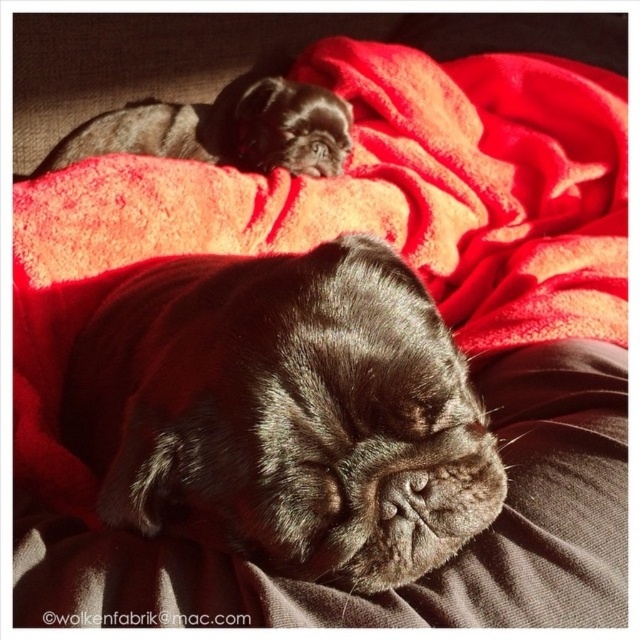
You are a photographer trying to capture both dogs in a single shot. Given that the camera can only focus on objects wider than 10 cm, will both the black fur dog at center and the shiny black dog at upper left be in focus?

The black fur dog at center is thinner than the shiny black dog at upper left. Since the camera requires objects wider than 10 cm to focus, we need to check both widths. However, the description only states their relative sizes, not absolute measurements. Without knowing the exact width of either dog, it is impossible to determine if both will be in focus.

You are a photographer trying to capture the black fur dog at center and the velvety red blanket at upper center in a single shot. Considering their sizes, which one do you think will appear larger in the photo?

The black fur dog at center is smaller than the velvety red blanket at upper center, so the velvety red blanket at upper center will appear larger in the photo.

You are a photographer setting up a shot of the velvety red blanket at upper center. You want to ensure the blanket is centered in the frame. Given that the camera sensor has a resolution of 1920x1080 pixels and the blanket is at coordinate point 0.306, 0.606, what pixel coordinates should you adjust to center the blanket?

The pixel coordinates to center the velvety red blanket at upper center would be calculated by multiplying the normalized coordinates by the sensor resolution. The x coordinate is 0.306 multiplied by 1920, resulting in approximately 587 pixels. The y coordinate is 0.606 multiplied by 1080, resulting in approximately 654 pixels. Therefore, adjusting to position the blanket at pixel coordinates around (639, 639) would center it in the frame.